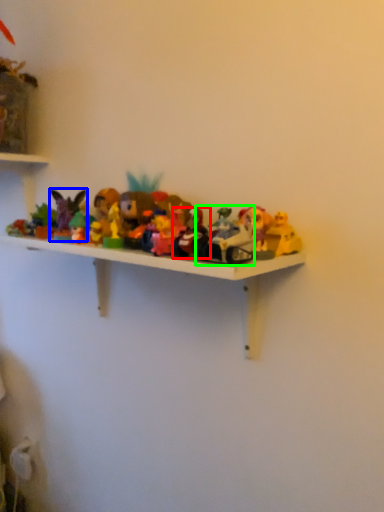
Question: Estimate the real-world distances between objects in this image. Which object is closer to toy (highlighted by a red box), toy (highlighted by a blue box) or toy (highlighted by a green box)?

Choices:
 (A) toy
 (B) toy

Answer: (B)